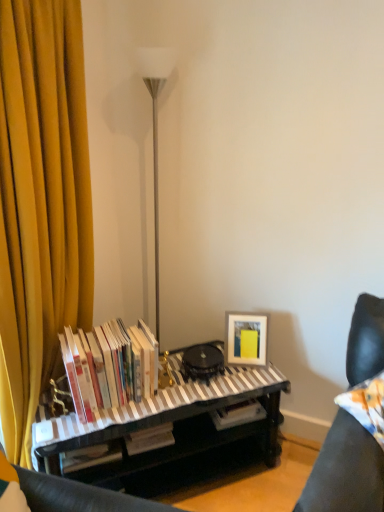
Where is `free space in front of matte white picture frame at lower right`? free space in front of matte white picture frame at lower right is located at coordinates 240,379.